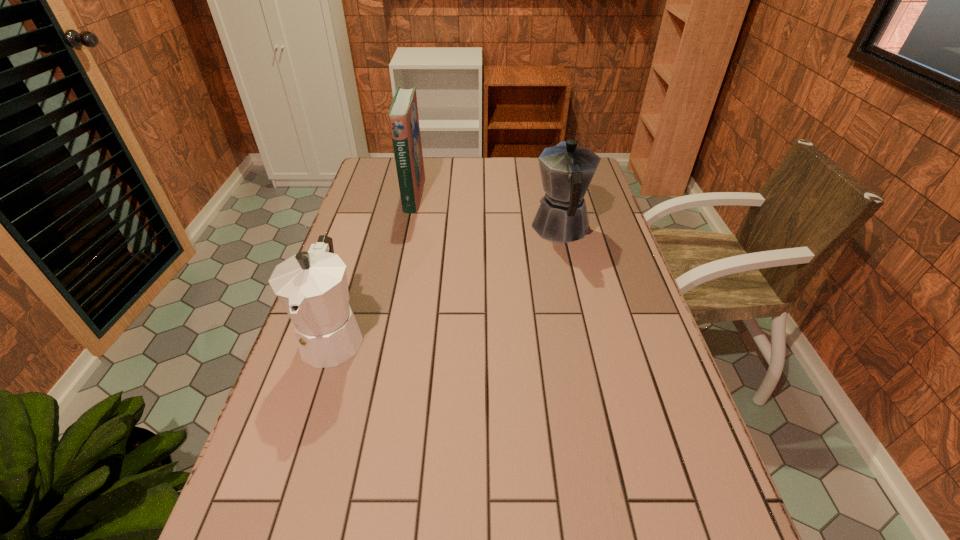
The width and height of the screenshot is (960, 540). Find the location of `object that is at the far edge`. object that is at the far edge is located at coordinates (x=403, y=115).

Where is `object present at the left edge`? This screenshot has height=540, width=960. object present at the left edge is located at coordinates (312, 286).

Locate an element on the screen. Image resolution: width=960 pixels, height=540 pixels. object situated at the right edge is located at coordinates (566, 169).

The height and width of the screenshot is (540, 960). Find the location of `vacant point at the left edge`. vacant point at the left edge is located at coordinates (378, 230).

Where is `free location at the right edge of the desktop`? free location at the right edge of the desktop is located at coordinates (640, 454).

Where is `free space at the far left corner of the desktop`? This screenshot has height=540, width=960. free space at the far left corner of the desktop is located at coordinates (377, 180).

Locate an element on the screen. The height and width of the screenshot is (540, 960). vacant region between the right coffeepot and the second object from right to left is located at coordinates (487, 211).

At what (x,y) coordinates should I click in order to perform the action: click on vacant space in between the rightmost object and the nearer coffeepot. Please return your answer as a coordinate pair (x, y). Looking at the image, I should click on (447, 282).

I want to click on vacant region between the right coffeepot and the nearer coffeepot, so pos(447,282).

Identify the location of free space between the left coffeepot and the farther coffeepot. The image size is (960, 540). pos(447,282).